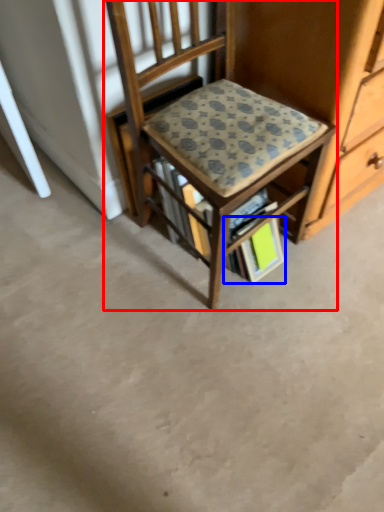
Question: Which object is further to the camera taking this photo, chair (highlighted by a red box) or paperback book (highlighted by a blue box)?

Choices:
 (A) chair
 (B) paperback book

Answer: (B)